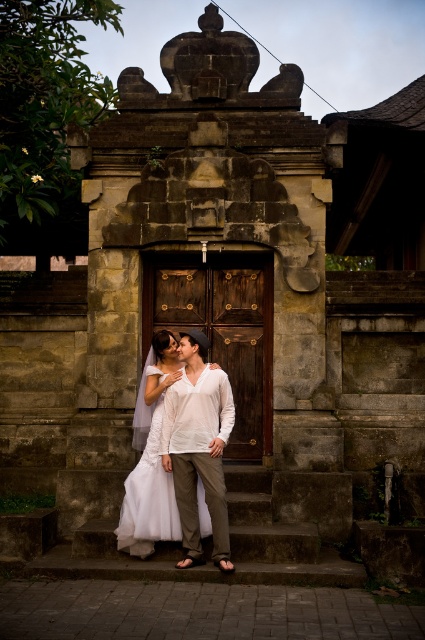
Can you confirm if white cotton shirt at center is positioned to the left of white lace dress at center?

In fact, white cotton shirt at center is to the right of white lace dress at center.

What do you see at coordinates (198, 448) in the screenshot? I see `white cotton shirt at center` at bounding box center [198, 448].

Is point (198, 412) positioned before point (153, 435)?

That is True.

You are a GUI agent. You are given a task and a screenshot of the screen. Output one action in this format:
    pyautogui.click(x=<x>, y=<y>)
    Task: Click on the white cotton shirt at center
    The image size is (425, 640).
    Given the screenshot: What is the action you would take?
    pyautogui.click(x=198, y=448)

Does point (110, 544) come in front of point (201, 387)?

Yes, it is in front of point (201, 387).

Can you confirm if stone stairs at center is positioned to the left of white cotton shirt at center?

No, stone stairs at center is not to the left of white cotton shirt at center.

Is point (260, 556) positioned in front of point (215, 516)?

No, it is not.

Identify the location of stone stairs at center. (282, 532).

Can you confirm if stone stairs at center is bigger than white lace dress at center?

No, stone stairs at center is not bigger than white lace dress at center.

Which is more to the right, stone stairs at center or white lace dress at center?

stone stairs at center

I want to click on stone stairs at center, so click(x=282, y=532).

Where is `stone stairs at center`? stone stairs at center is located at coordinates (282, 532).